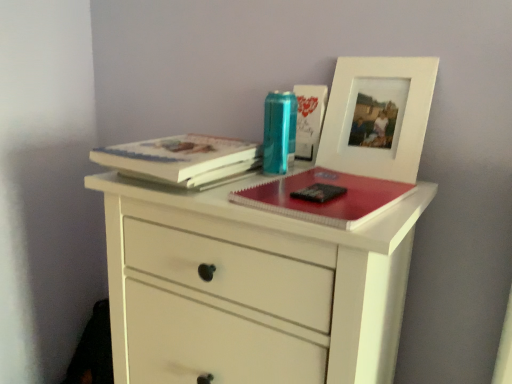
Question: Can you confirm if white matte chest of drawers at center is thinner than matte red notebook at center?

Choices:
 (A) yes
 (B) no

Answer: (B)

Question: Is white matte chest of drawers at center wider than matte red notebook at center?

Choices:
 (A) no
 (B) yes

Answer: (B)

Question: From a real-world perspective, does white matte chest of drawers at center sit lower than matte red notebook at center?

Choices:
 (A) no
 (B) yes

Answer: (B)

Question: Is white matte chest of drawers at center taller than matte red notebook at center?

Choices:
 (A) yes
 (B) no

Answer: (A)

Question: Does white matte chest of drawers at center have a lesser height compared to matte red notebook at center?

Choices:
 (A) yes
 (B) no

Answer: (B)

Question: Is white matte chest of drawers at center located outside matte red notebook at center?

Choices:
 (A) yes
 (B) no

Answer: (A)

Question: From a real-world perspective, is matte red notebook at center located higher than hardcover book at upper left, marked as the 2th paperback book in a right-to-left arrangement?

Choices:
 (A) yes
 (B) no

Answer: (B)

Question: Does matte red notebook at center have a larger size compared to hardcover book at upper left, marked as the 2th paperback book in a right-to-left arrangement?

Choices:
 (A) yes
 (B) no

Answer: (B)

Question: Can you confirm if matte red notebook at center is positioned to the left of hardcover book at upper left, which is the 1th paperback book from left to right?

Choices:
 (A) no
 (B) yes

Answer: (A)

Question: Considering the relative positions of matte red notebook at center and hardcover book at upper left, which is the 1th paperback book from left to right, in the image provided, is matte red notebook at center in front of hardcover book at upper left, which is the 1th paperback book from left to right,?

Choices:
 (A) no
 (B) yes

Answer: (B)

Question: Are matte red notebook at center and hardcover book at upper left, which is the 1th paperback book from left to right, located far from each other?

Choices:
 (A) no
 (B) yes

Answer: (A)

Question: From the image's perspective, does matte red notebook at center appear lower than hardcover book at upper left, which is the 1th paperback book from left to right?

Choices:
 (A) yes
 (B) no

Answer: (A)

Question: Can white matte picture frame at upper right be found inside hardcover book at upper left, which is the 1th paperback book from left to right?

Choices:
 (A) no
 (B) yes

Answer: (A)